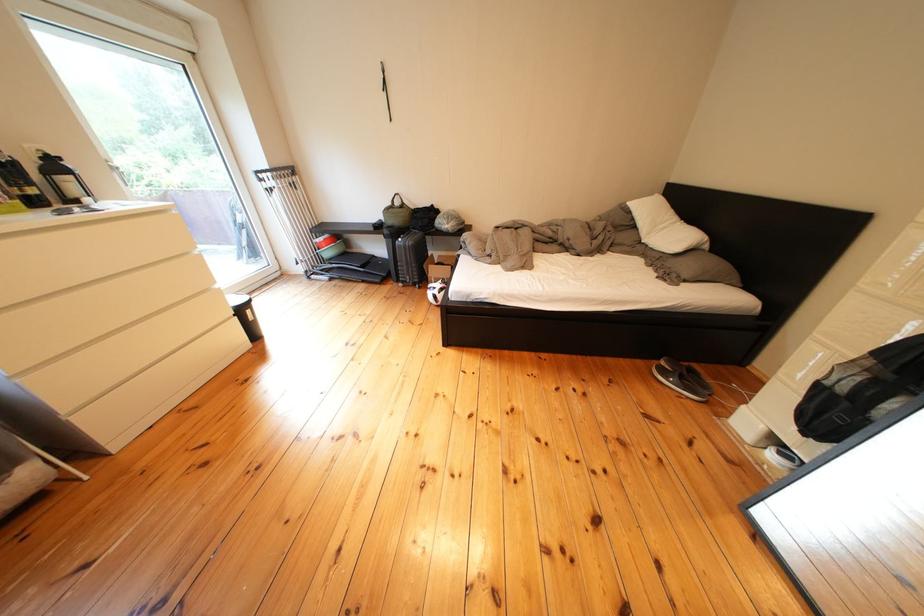
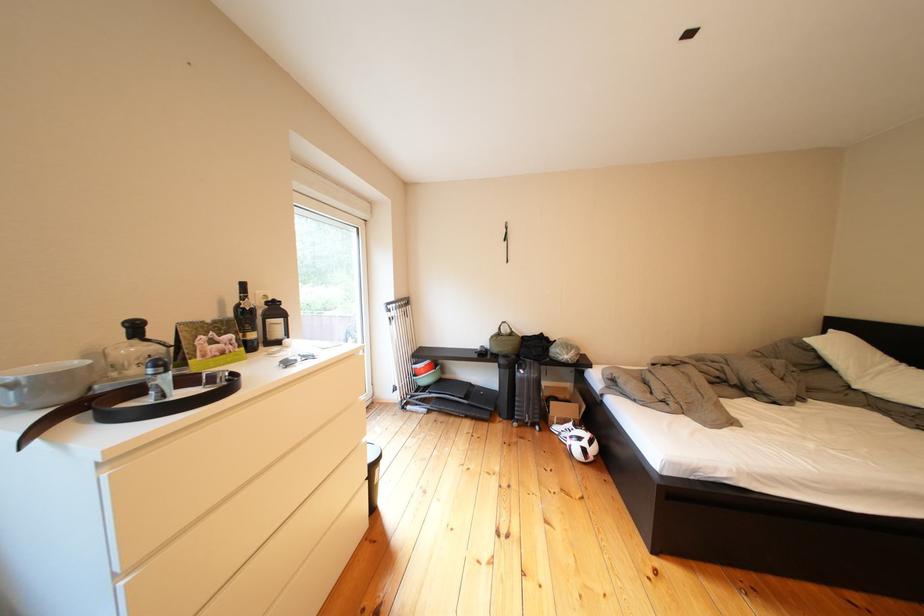
The point at (445,290) is marked in the first image. Where is the corresponding point in the second image?

(570, 432)